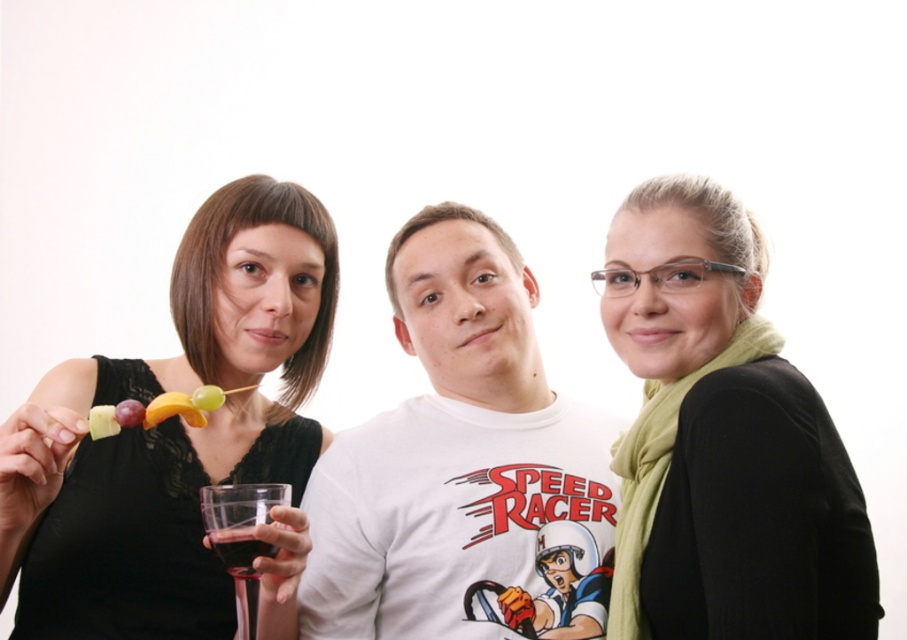
Looking at this image, is black lace dress at upper left below matte plastic skewer with fruit at left?

Actually, black lace dress at upper left is above matte plastic skewer with fruit at left.

Is black lace dress at upper left to the left of matte plastic skewer with fruit at left from the viewer's perspective?

Correct, you'll find black lace dress at upper left to the left of matte plastic skewer with fruit at left.

Describe the element at coordinates (171, 432) in the screenshot. I see `black lace dress at upper left` at that location.

Where is `black lace dress at upper left`? black lace dress at upper left is located at coordinates (x=171, y=432).

Which is below, transparent glass at center or purple matte grape at upper left?

transparent glass at center is below.

Is point (241, 522) behind point (130, 412)?

No, (241, 522) is closer to viewer.

Identify the location of transparent glass at center. (239, 548).

Where is `transparent glass at center`? transparent glass at center is located at coordinates [x=239, y=548].

Does black lace dress at upper left come in front of green scarf at center?

No, it is not.

What do you see at coordinates (171, 432) in the screenshot?
I see `black lace dress at upper left` at bounding box center [171, 432].

You are a GUI agent. You are given a task and a screenshot of the screen. Output one action in this format:
    pyautogui.click(x=<x>, y=<y>)
    Task: Click on the black lace dress at upper left
    The width and height of the screenshot is (907, 640).
    Given the screenshot: What is the action you would take?
    pyautogui.click(x=171, y=432)

Identify the location of black lace dress at upper left. (171, 432).